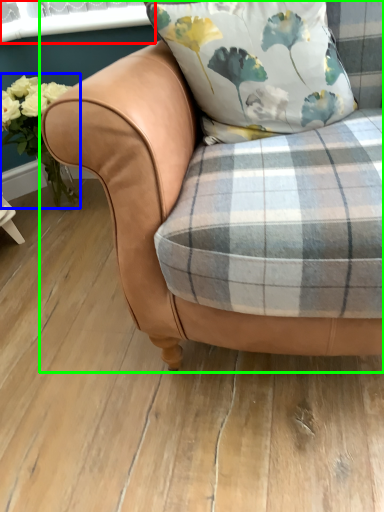
Question: Based on their relative distances, which object is farther from window screen (highlighted by a red box)? Choose from floral arrangement (highlighted by a blue box) and chair (highlighted by a green box).

Choices:
 (A) floral arrangement
 (B) chair

Answer: (B)